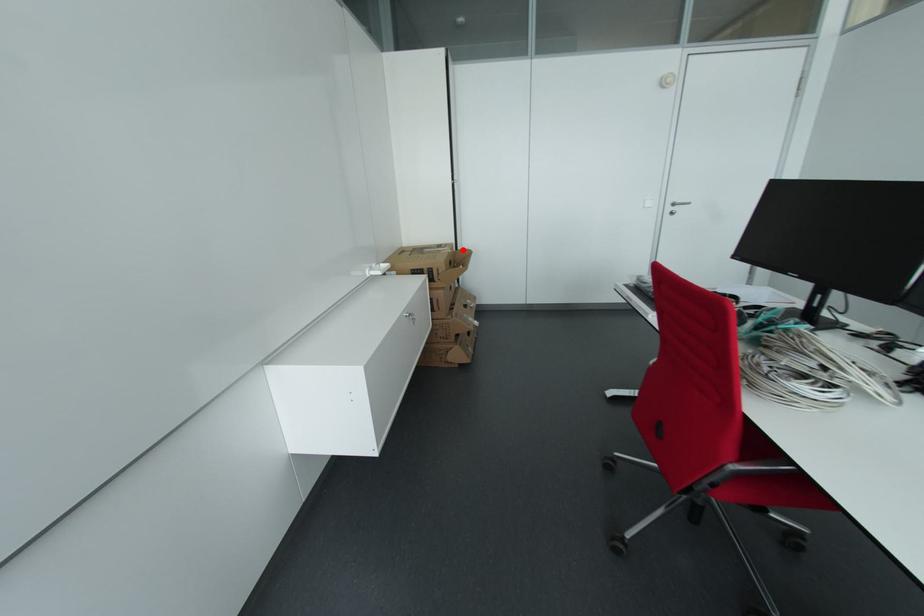
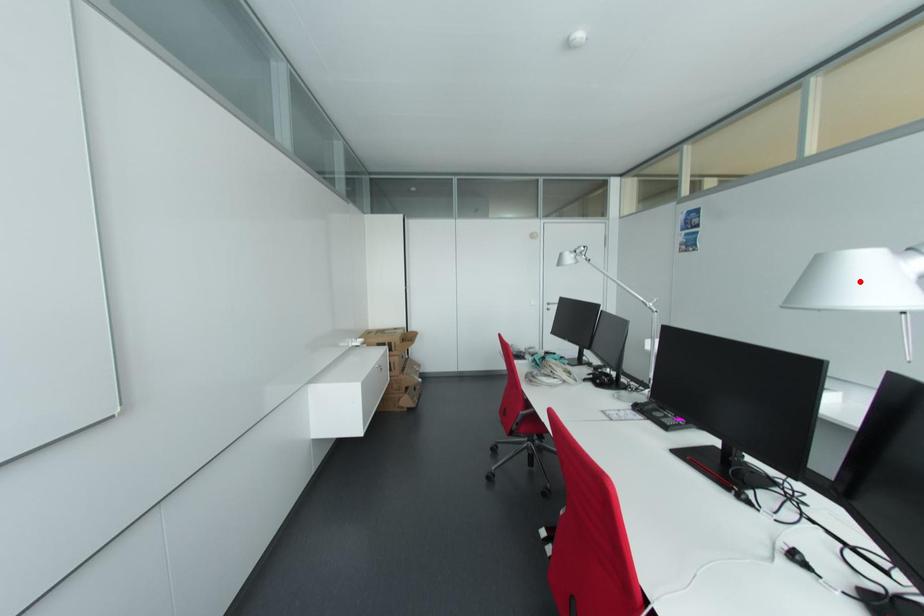
I am providing you with two images of the same scene from different viewpoints. A red point is marked on the first image and another point is marked on the second image. Do the highlighted points in image1 and image2 indicate the same real-world spot?

No